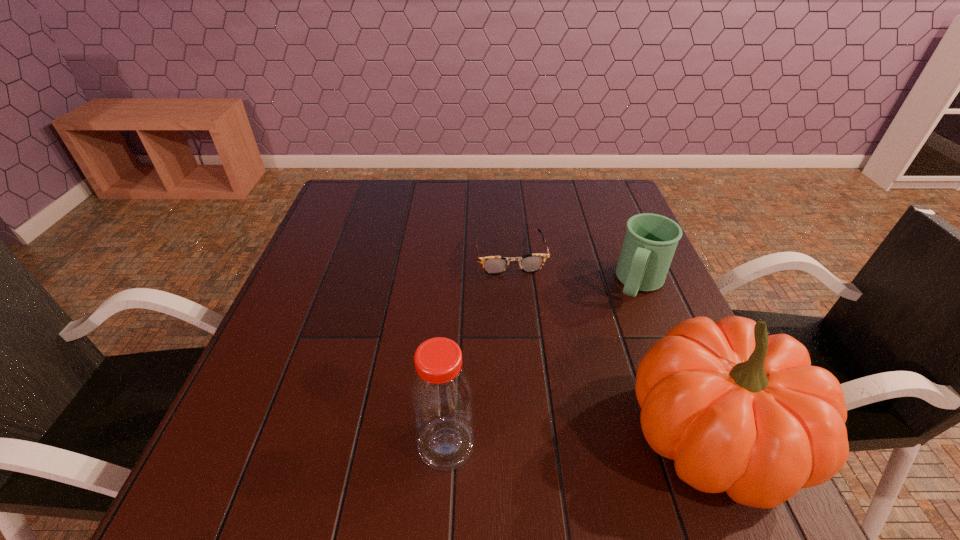
What are the coordinates of `free space located 0.080m on the side of the third tallest object with the handle` in the screenshot? It's located at (623, 327).

Locate an element on the screen. free location located on the side of the third tallest object with the handle is located at coordinates (613, 348).

Where is `bottle at the near edge`? The image size is (960, 540). bottle at the near edge is located at coordinates (441, 394).

Locate an element on the screen. The image size is (960, 540). pumpkin present at the near edge is located at coordinates (739, 411).

Identify the location of pumpkin present at the right edge. This screenshot has height=540, width=960. tap(739, 411).

Image resolution: width=960 pixels, height=540 pixels. I want to click on mug situated at the right edge, so click(650, 241).

The height and width of the screenshot is (540, 960). What are the coordinates of `object located in the near right corner section of the desktop` in the screenshot? It's located at (739, 411).

This screenshot has height=540, width=960. I want to click on free space at the far edge of the desktop, so click(x=545, y=187).

The width and height of the screenshot is (960, 540). Find the location of `free point at the near edge`. free point at the near edge is located at coordinates (341, 422).

Locate an element on the screen. This screenshot has width=960, height=540. free region at the left edge is located at coordinates (309, 305).